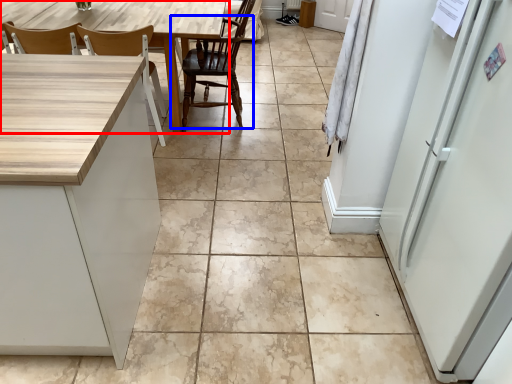
Question: Among these objects, which one is nearest to the camera, table (highlighted by a red box) or chair (highlighted by a blue box)?

Choices:
 (A) table
 (B) chair

Answer: (A)